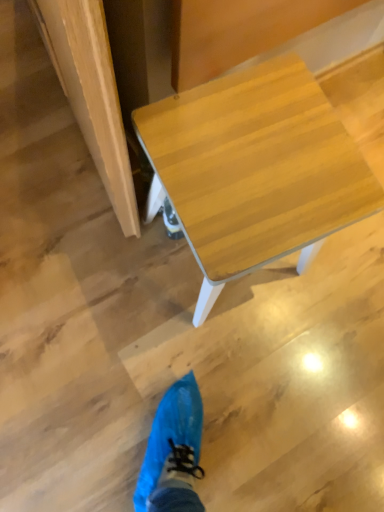
What are the coordinates of `empty space that is to the right of light wood table at center` in the screenshot? It's located at (328, 303).